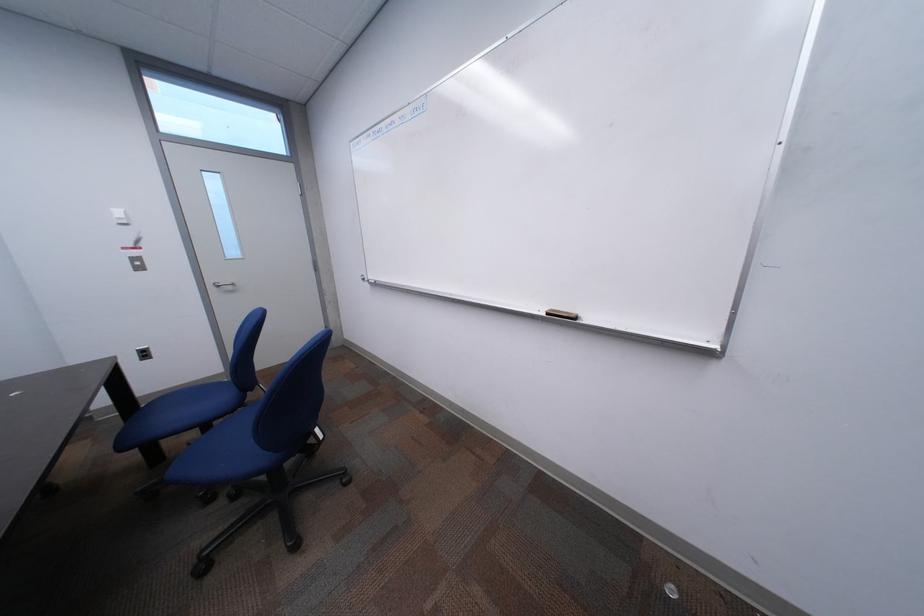
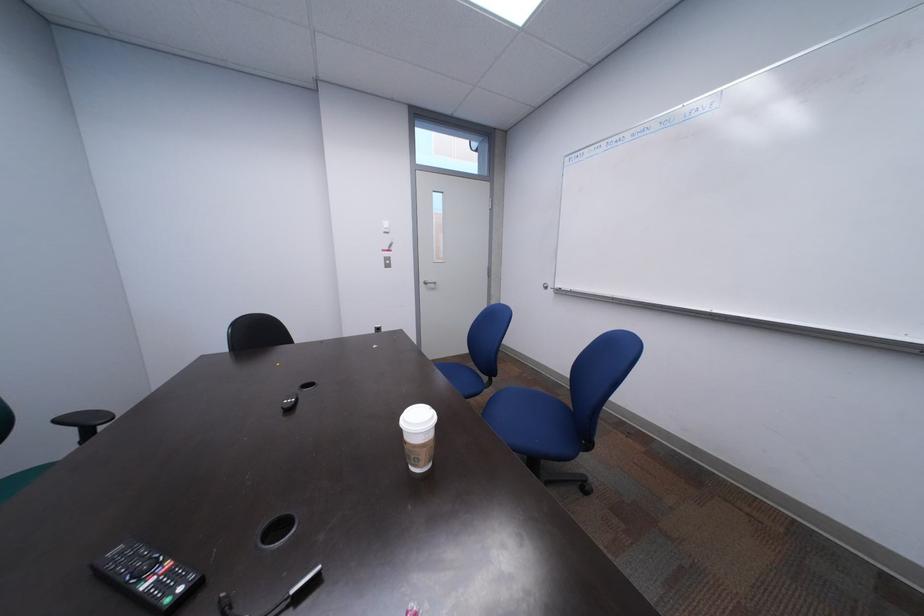
Question: Based on the continuous images, in which direction is the camera rotating? Reply with the corresponding letter.

Choices:
 (A) Left
 (B) Right
 (C) Up
 (D) Down

Answer: (A)